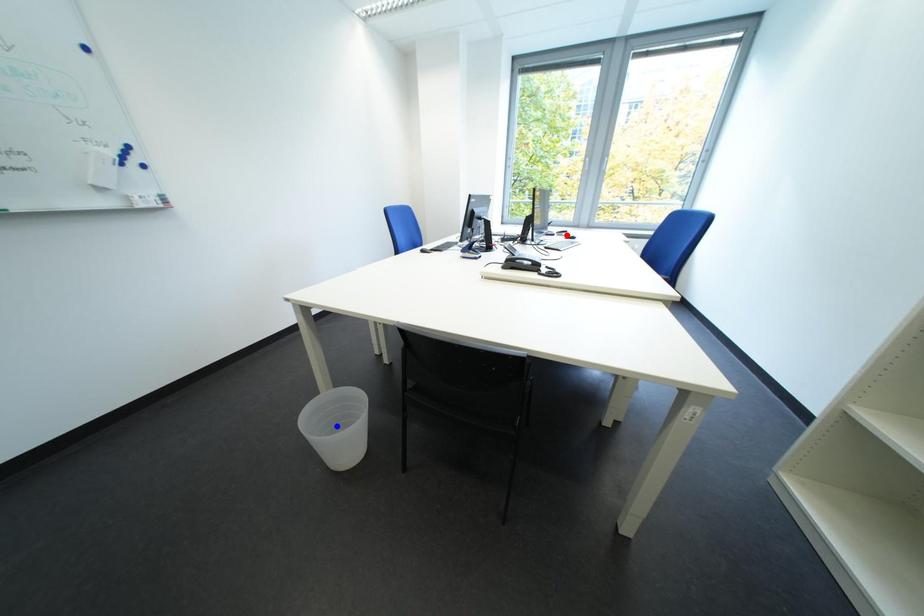
Question: In the image, two points are highlighted. Which point is nearer to the camera? Reply with the corresponding letter.

Choices:
 (A) blue point
 (B) red point

Answer: (A)